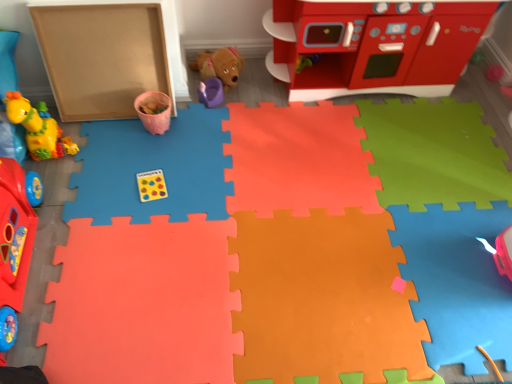
Locate an element on the screen. spots to the right of brown plush dog at center, positioned as the third toy in right-to-left order is located at coordinates (266, 97).